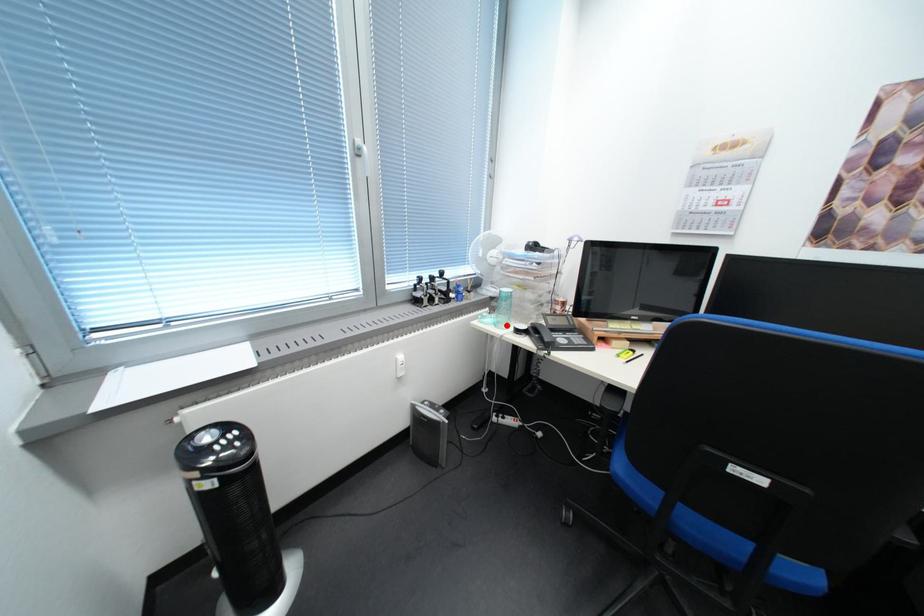
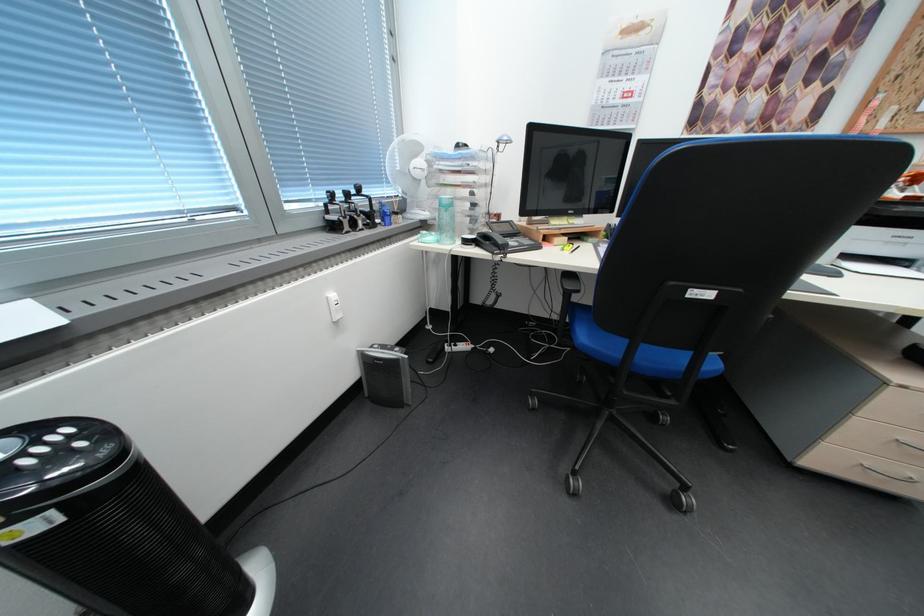
Question: I am providing you with two images of the same scene from different viewpoints. In image1, a red point is highlighted. Considering the same 3D point in image2, which of the following is correct?

Choices:
 (A) It is closer
 (B) It is farther

Answer: (A)